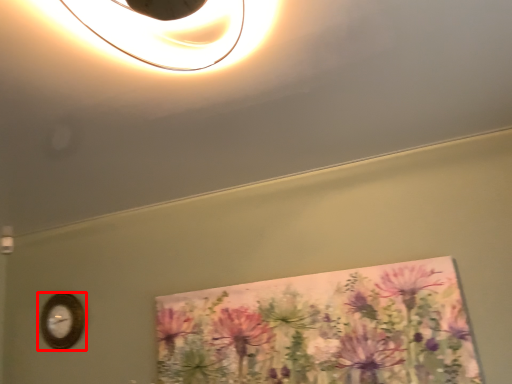
Question: From the image's perspective, considering the relative positions of wall clock (annotated by the red box) and flower in the image provided, where is wall clock (annotated by the red box) located with respect to the staircase?

Choices:
 (A) below
 (B) above

Answer: (A)